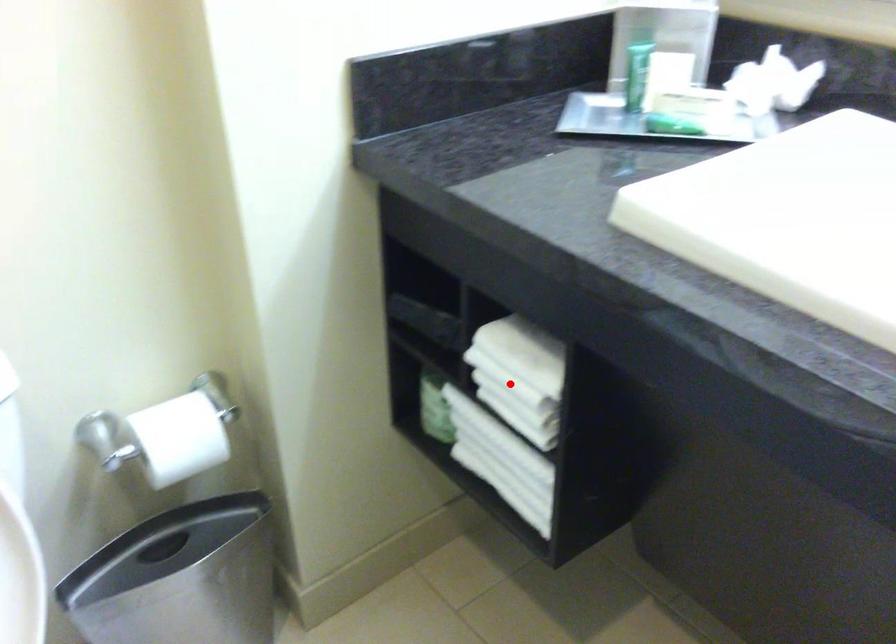
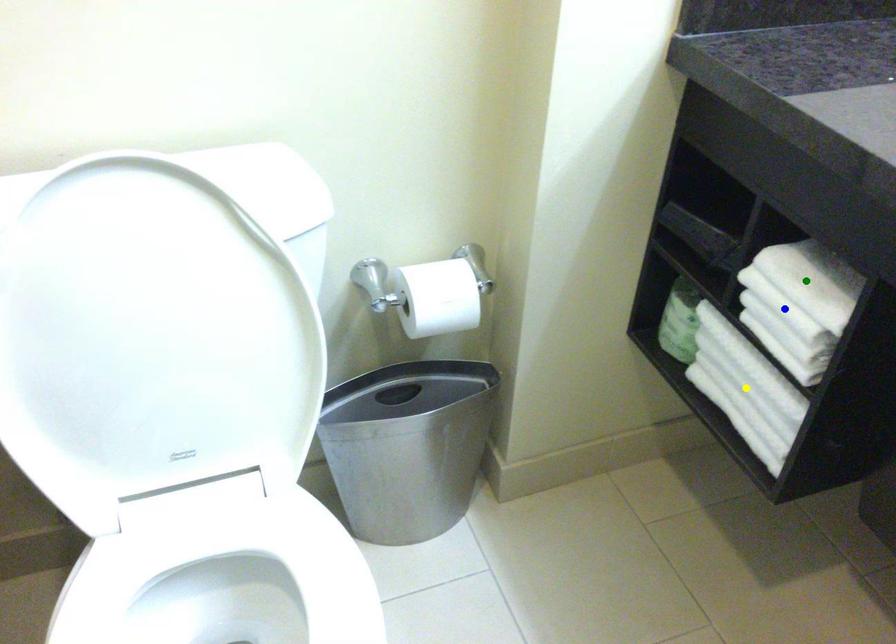
Question: I am providing you with two images of the same scene from different viewpoints. A red point is marked on the first image. You are given multiple points on the second image. Which spot in image 2 lines up with the point in image 1?

Choices:
 (A) blue point
 (B) green point
 (C) yellow point

Answer: (A)